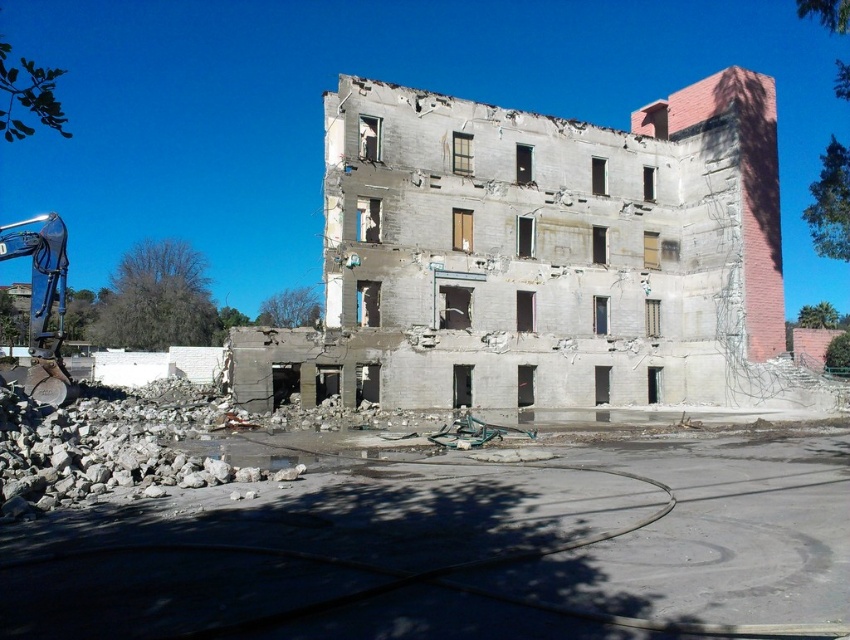
You are a construction worker assessing the demolition site. You need to determine if the crumbled concrete debris at lower left can be moved by the metallic blue excavator arm at left without needing to adjust its position. Can you confirm if the height of the debris is less than the excavator arm?

The crumbled concrete debris at lower left is not as tall as the metallic blue excavator arm at left, so yes, the height of the debris is less than the excavator arm. The excavator arm can move it without needing to adjust its position.